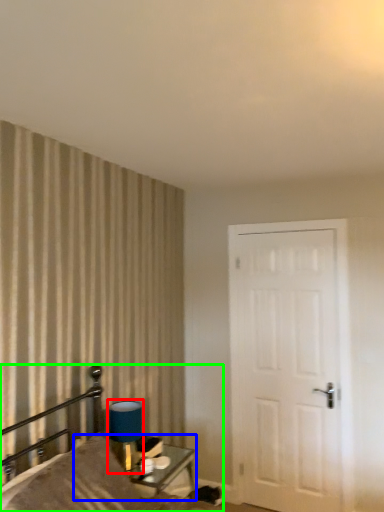
Question: Considering the real-world distances, which object is closest to table lamp (highlighted by a red box)? table (highlighted by a blue box) or bed (highlighted by a green box).

Choices:
 (A) table
 (B) bed

Answer: (B)